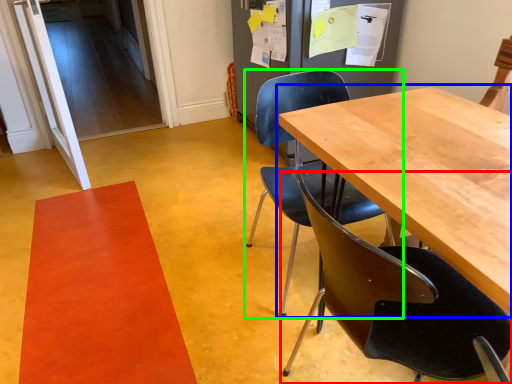
Question: Which is nearer to the chair (highlighted by a red box)? table (highlighted by a blue box) or chair (highlighted by a green box).

Choices:
 (A) table
 (B) chair

Answer: (A)